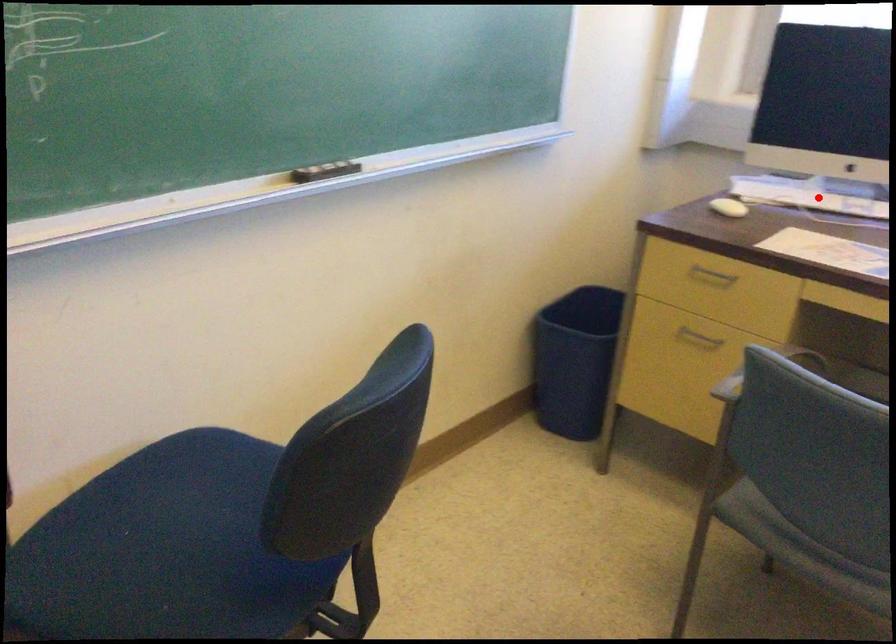
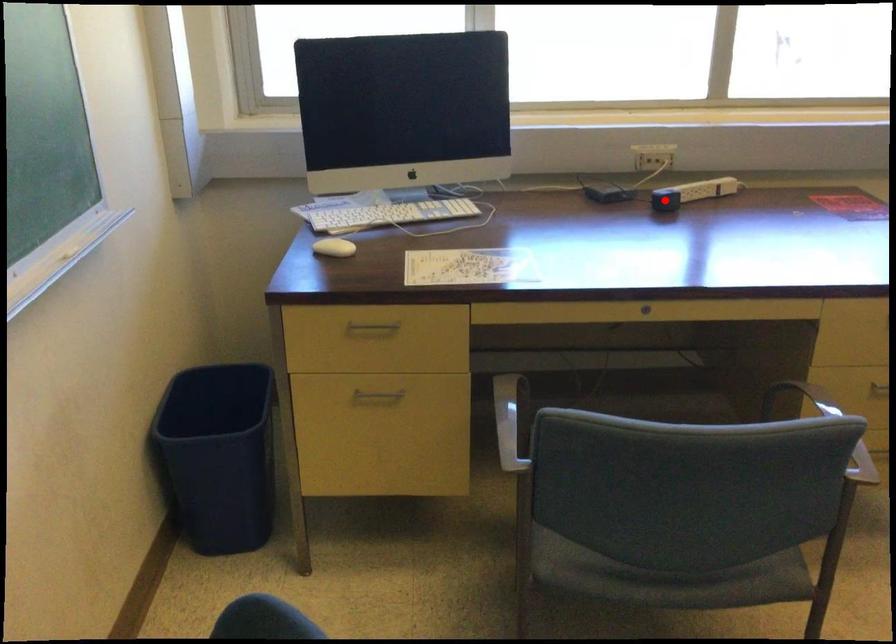
I am providing you with two images of the same scene from different viewpoints. A red point is marked on the first image and another point is marked on the second image. Does the point marked in image1 correspond to the same location as the one in image2?

No